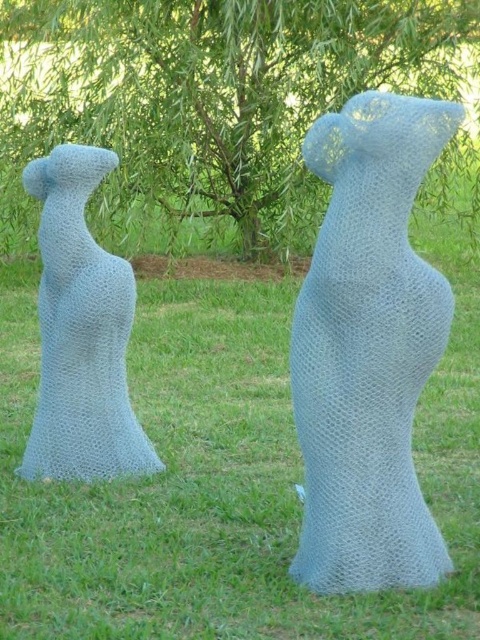
Describe the element at coordinates (368, 349) in the screenshot. I see `light blue mesh bear at center` at that location.

Is point (375, 573) farther from viewer compared to point (88, 358)?

That is False.

Where is `light blue mesh bear at center`? light blue mesh bear at center is located at coordinates click(368, 349).

Who is positioned more to the right, green leafy tree at center or textured blue sculpture at left?

green leafy tree at center is more to the right.

Between point (141, 209) and point (85, 428), which one is positioned in front?

Point (85, 428)

Measure the distance between point (13, 36) and camera.

Point (13, 36) is 8.72 meters away from camera.

Image resolution: width=480 pixels, height=640 pixels. In order to click on green leafy tree at center in this screenshot , I will do [222, 109].

Who is more distant from viewer, [445,44] or [428,330]?

→ Positioned behind is point [445,44].

Can you confirm if green leafy tree at center is smaller than light blue mesh bear at center?

Incorrect, green leafy tree at center is not smaller in size than light blue mesh bear at center.

Where is `green leafy tree at center`? The image size is (480, 640). green leafy tree at center is located at coordinates (222, 109).